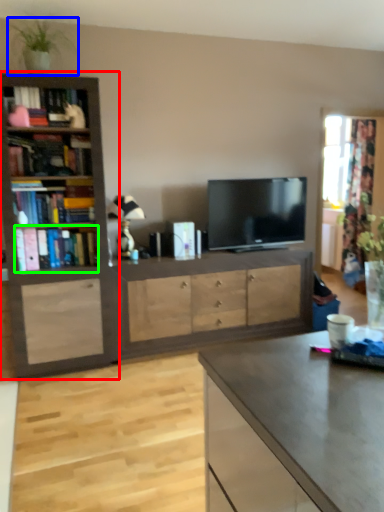
Question: Considering the real-world distances, which object is farthest from bookcase (highlighted by a red box)? houseplant (highlighted by a blue box) or book (highlighted by a green box)?

Choices:
 (A) houseplant
 (B) book

Answer: (A)